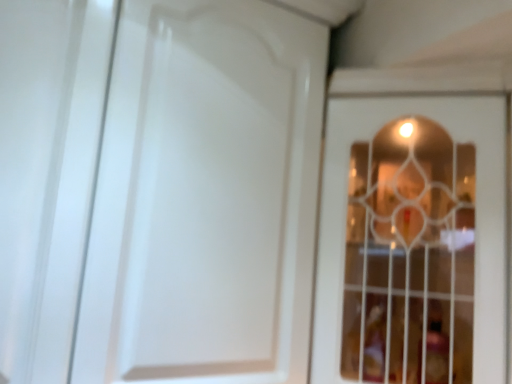
Question: Would you say white glossy door at center, which is the second door from right to left, is inside or outside white glass door at center, the first door positioned from the right?

Choices:
 (A) outside
 (B) inside

Answer: (A)

Question: In the image, is white glossy door at center, the 1th door from the left, positioned in front of or behind white glass door at center, the first door positioned from the right?

Choices:
 (A) front
 (B) behind

Answer: (B)

Question: From their relative heights in the image, would you say white glossy door at center, which is the second door from right to left, is taller or shorter than white glass door at center, the first door positioned from the right?

Choices:
 (A) short
 (B) tall

Answer: (B)

Question: Is white glass door at center, the first door positioned from the right, in front of or behind white glossy door at center, the 1th door from the left, in the image?

Choices:
 (A) behind
 (B) front

Answer: (B)

Question: From the image's perspective, relative to white glossy door at center, the 1th door from the left, is white glass door at center, the 2th door from the left, above or below?

Choices:
 (A) below
 (B) above

Answer: (A)

Question: Looking at their shapes, would you say white glass door at center, the first door positioned from the right, is wider or thinner than white glossy door at center, the 1th door from the left?

Choices:
 (A) wide
 (B) thin

Answer: (A)

Question: From a real-world perspective, is white glass door at center, the 2th door from the left, physically located above or below white glossy door at center, the 1th door from the left?

Choices:
 (A) below
 (B) above

Answer: (A)